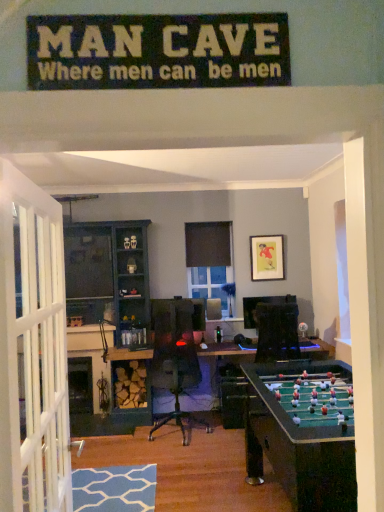
Question: Considering the relative positions of matte black picture frame at upper center and teal wood entertainment center at left in the image provided, is matte black picture frame at upper center behind teal wood entertainment center at left?

Choices:
 (A) no
 (B) yes

Answer: (B)

Question: Is matte black picture frame at upper center next to teal wood entertainment center at left?

Choices:
 (A) yes
 (B) no

Answer: (B)

Question: Can you confirm if matte black picture frame at upper center is shorter than teal wood entertainment center at left?

Choices:
 (A) no
 (B) yes

Answer: (B)

Question: From the image's perspective, does matte black picture frame at upper center appear lower than teal wood entertainment center at left?

Choices:
 (A) no
 (B) yes

Answer: (A)

Question: From a real-world perspective, is matte black picture frame at upper center beneath teal wood entertainment center at left?

Choices:
 (A) yes
 (B) no

Answer: (B)

Question: Considering the relative sizes of matte black picture frame at upper center and teal wood entertainment center at left in the image provided, is matte black picture frame at upper center wider than teal wood entertainment center at left?

Choices:
 (A) no
 (B) yes

Answer: (A)

Question: Would you say teal wood entertainment center at left contains matte black picture frame at upper center?

Choices:
 (A) yes
 (B) no

Answer: (B)

Question: From the image's perspective, is teal wood entertainment center at left located above matte black picture frame at upper center?

Choices:
 (A) yes
 (B) no

Answer: (B)

Question: Can you confirm if teal wood entertainment center at left is positioned to the right of matte black picture frame at upper center?

Choices:
 (A) no
 (B) yes

Answer: (A)

Question: Can you confirm if teal wood entertainment center at left is smaller than matte black picture frame at upper center?

Choices:
 (A) no
 (B) yes

Answer: (A)

Question: Is teal wood entertainment center at left in contact with matte black picture frame at upper center?

Choices:
 (A) yes
 (B) no

Answer: (B)

Question: Considering the relative sizes of teal wood entertainment center at left and matte black picture frame at upper center in the image provided, is teal wood entertainment center at left shorter than matte black picture frame at upper center?

Choices:
 (A) no
 (B) yes

Answer: (A)

Question: Looking at the image, does matte black picture frame at upper center seem bigger or smaller compared to teal wood entertainment center at left?

Choices:
 (A) small
 (B) big

Answer: (A)